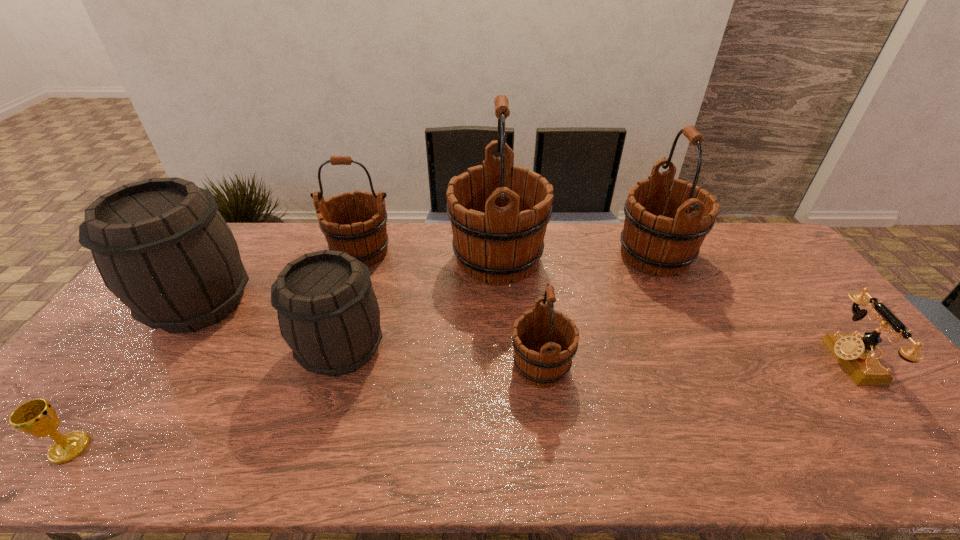
You are a GUI agent. You are given a task and a screenshot of the screen. Output one action in this format:
    pyautogui.click(x=<x>, y=<y>)
    Task: Click on the second shortest object
    Image resolution: width=960 pixels, height=540 pixels.
    Given the screenshot: What is the action you would take?
    pyautogui.click(x=856, y=355)

Locate an element on the screen. the nearest object is located at coordinates (38, 418).

Locate an element on the screen. Image resolution: width=960 pixels, height=540 pixels. gold chalice is located at coordinates (38, 418).

Where is `vacant space located 0.390m on the left of the tallest object`? vacant space located 0.390m on the left of the tallest object is located at coordinates (336, 259).

At what (x,y) coordinates should I click in order to perform the action: click on vacant point located on the front of the seventh object from left to right. Please return your answer as a coordinate pair (x, y). The image size is (960, 540). Looking at the image, I should click on pyautogui.click(x=715, y=381).

This screenshot has height=540, width=960. In order to click on vacant area situated 0.100m on the right of the leftmost wood wine bucket in this screenshot , I will do `click(424, 252)`.

Find the location of a particular element. This screenshot has width=960, height=540. free spot located 0.250m on the front of the left brown wine bucket is located at coordinates (115, 426).

The image size is (960, 540). Find the location of `vacant area situated on the back of the smaller brown wine bucket`. vacant area situated on the back of the smaller brown wine bucket is located at coordinates (363, 279).

The width and height of the screenshot is (960, 540). I want to click on vacant region located on the left of the smallest wood wine bucket, so click(378, 366).

This screenshot has width=960, height=540. Find the location of `vacant space situated 0.090m on the dial of the rightmost object`. vacant space situated 0.090m on the dial of the rightmost object is located at coordinates (797, 360).